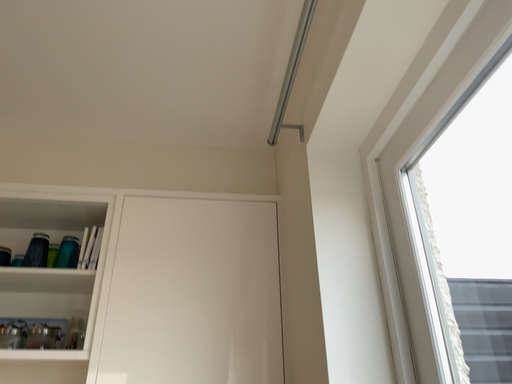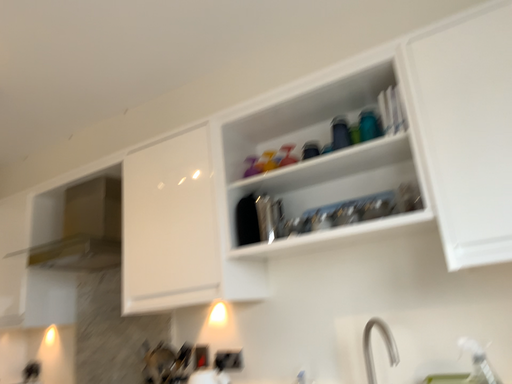
Question: Which way did the camera rotate in the video?

Choices:
 (A) rotated right
 (B) rotated left

Answer: (B)